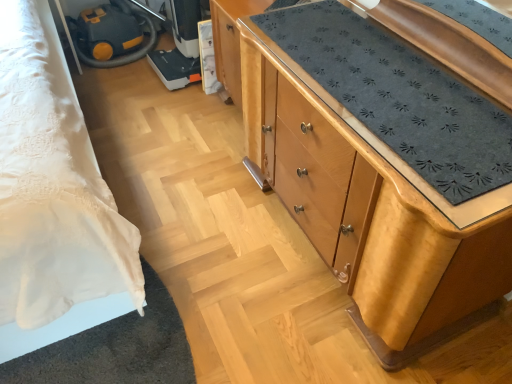
Where is `empty space that is ontop of wooden chest of drawers at center (from a real-world perspective)`? This screenshot has width=512, height=384. empty space that is ontop of wooden chest of drawers at center (from a real-world perspective) is located at coordinates (387, 89).